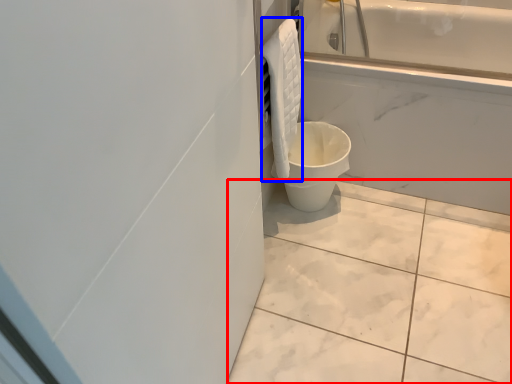
Question: Among these objects, which one is farthest to the camera, ceramic tile (highlighted by a red box) or material (highlighted by a blue box)?

Choices:
 (A) ceramic tile
 (B) material

Answer: (B)